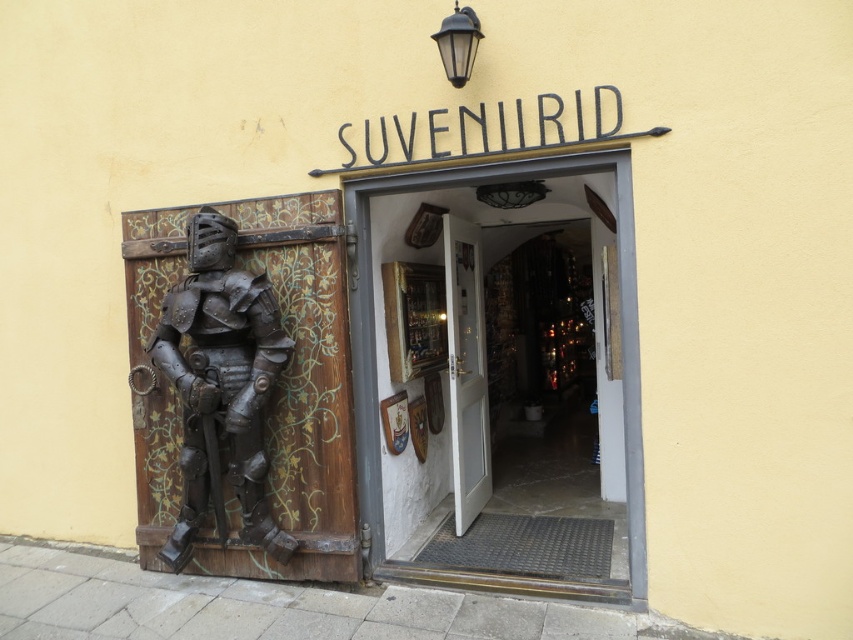
You are a delivery person trying to unload a large package that is the same size as the bronze armor at left. Can you fit the package through the wooden door at center without needing to adjust its size?

The bronze armor at left occupies less space than wooden door at center, so the package can fit through the wooden door at center as it is smaller than the door.

You are a delivery person with a cart that is 1.5 meters wide. You need to bring a package to the shop entrance. Can you pass between the bronze armor at left and the white wooden door at center without hitting the armor?

The bronze armor at left is 1.57 meters away from the white wooden door at center. Since your cart is 1.5 meters wide, which is slightly narrower than the distance between them, you can pass through without hitting the armor.